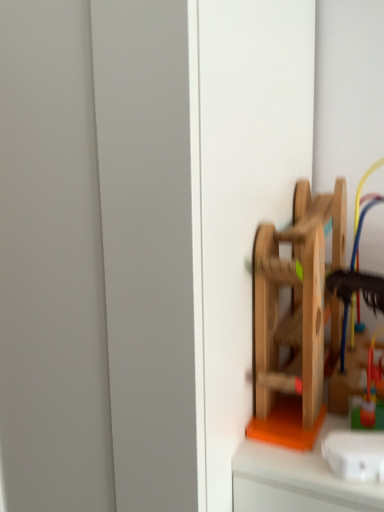
Question: From the image's perspective, is rubberized plastic toy at right, acting as the first toy starting from the back, below wooden toy at right, which is counted as the 2th toy, starting from the back?

Choices:
 (A) yes
 (B) no

Answer: (A)

Question: Is rubberized plastic toy at right, acting as the first toy starting from the back, surrounding wooden toy at right, the first toy when ordered from front to back?

Choices:
 (A) no
 (B) yes

Answer: (A)

Question: Is there a large distance between rubberized plastic toy at right, acting as the first toy starting from the back, and wooden toy at right, which is counted as the 2th toy, starting from the back?

Choices:
 (A) yes
 (B) no

Answer: (B)

Question: From a real-world perspective, does rubberized plastic toy at right, acting as the first toy starting from the back, stand above wooden toy at right, which is counted as the 2th toy, starting from the back?

Choices:
 (A) yes
 (B) no

Answer: (B)

Question: Is rubberized plastic toy at right, acting as the first toy starting from the back, beside wooden toy at right, which is counted as the 2th toy, starting from the back?

Choices:
 (A) no
 (B) yes

Answer: (A)

Question: Is rubberized plastic toy at right, acting as the first toy starting from the back, aimed at wooden toy at right, the first toy when ordered from front to back?

Choices:
 (A) yes
 (B) no

Answer: (B)

Question: From the image's perspective, is wooden toy at right, the first toy when ordered from front to back, under rubberized plastic toy at right, acting as the first toy starting from the back?

Choices:
 (A) no
 (B) yes

Answer: (A)

Question: Is wooden toy at right, the first toy when ordered from front to back, smaller than rubberized plastic toy at right, acting as the first toy starting from the back?

Choices:
 (A) no
 (B) yes

Answer: (A)

Question: Considering the relative sizes of wooden toy at right, the first toy when ordered from front to back, and rubberized plastic toy at right, acting as the first toy starting from the back, in the image provided, is wooden toy at right, the first toy when ordered from front to back, thinner than rubberized plastic toy at right, acting as the first toy starting from the back,?

Choices:
 (A) yes
 (B) no

Answer: (B)

Question: From a real-world perspective, is wooden toy at right, the first toy when ordered from front to back, over rubberized plastic toy at right, acting as the first toy starting from the back?

Choices:
 (A) no
 (B) yes

Answer: (B)

Question: Is wooden toy at right, which is counted as the 2th toy, starting from the back, at the left side of rubberized plastic toy at right, acting as the first toy starting from the back?

Choices:
 (A) no
 (B) yes

Answer: (B)

Question: Is wooden toy at right, which is counted as the 2th toy, starting from the back, oriented away from rubberized plastic toy at right, the second toy viewed from the front?

Choices:
 (A) no
 (B) yes

Answer: (A)

Question: Considering the positions of wooden toy at right, the first toy when ordered from front to back, and rubberized plastic toy at right, the second toy viewed from the front, in the image, is wooden toy at right, the first toy when ordered from front to back, bigger or smaller than rubberized plastic toy at right, the second toy viewed from the front,?

Choices:
 (A) small
 (B) big

Answer: (B)